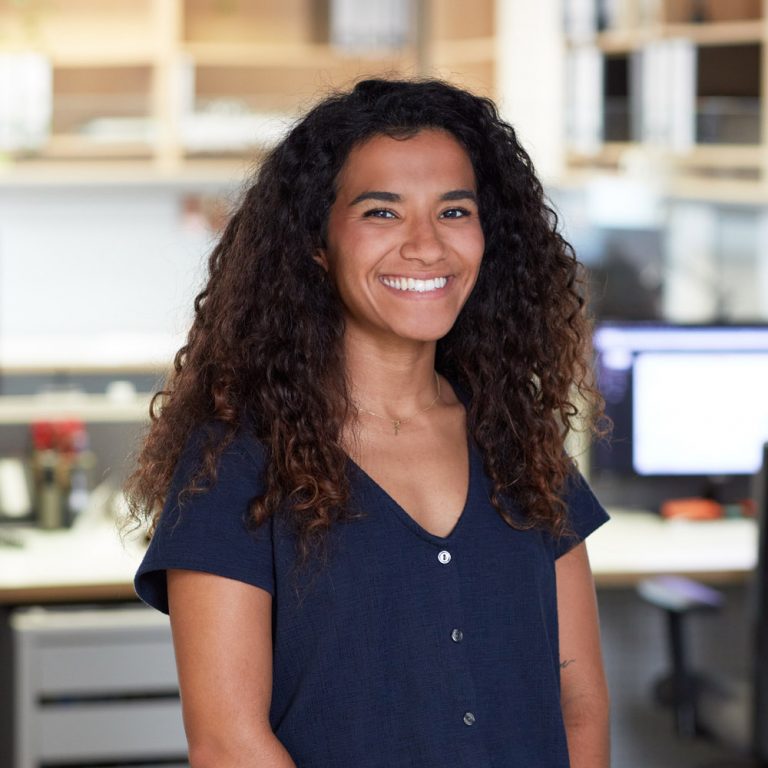
Find the location of a particular element. Image resolution: width=768 pixels, height=768 pixels. computer is located at coordinates (680, 409).